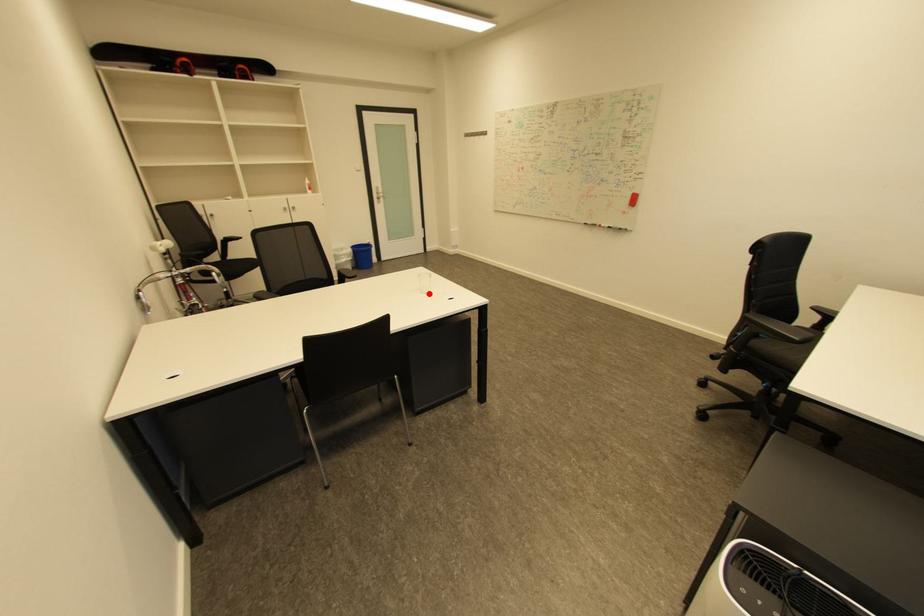
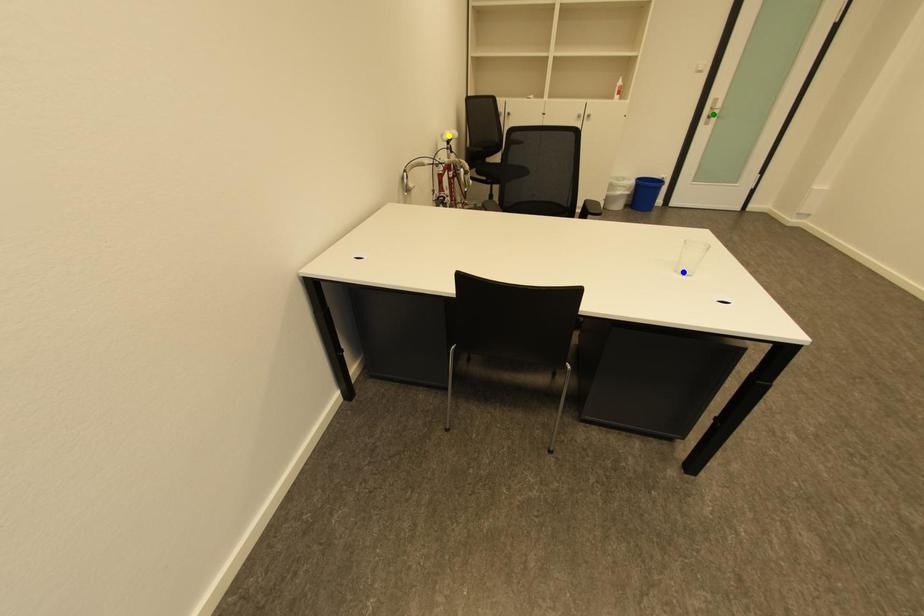
Question: I am providing you with two images of the same scene from different viewpoints. A red point is marked on the first image. You are given multiple points on the second image. Which spot in image 2 lines up with the point in image 1?

Choices:
 (A) green point
 (B) yellow point
 (C) blue point

Answer: (C)